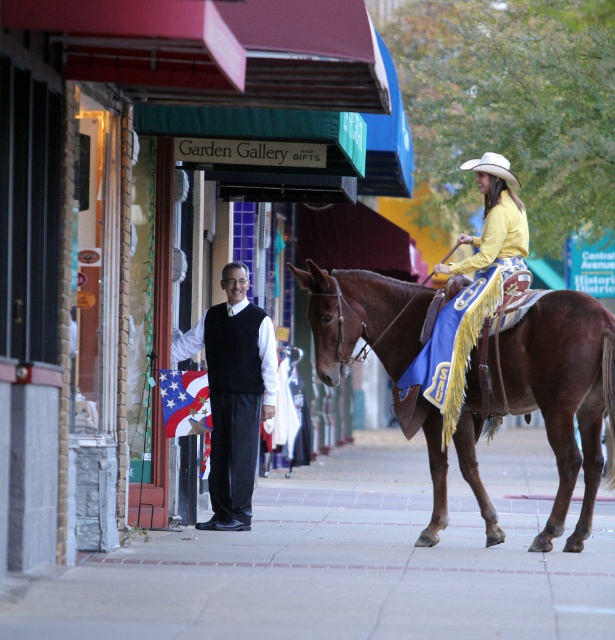
Can you confirm if smooth concrete pavement at center is positioned below black matte vest at center?

Yes.

Between smooth concrete pavement at center and black matte vest at center, which one has less height?

With less height is smooth concrete pavement at center.

Is point (538, 493) positioned in front of point (229, 330)?

No.

Where is `smooth concrete pavement at center`? The image size is (615, 640). smooth concrete pavement at center is located at coordinates (347, 560).

Can you confirm if smooth concrete pavement at center is shorter than brown leather horse at center?

Indeed, smooth concrete pavement at center has a lesser height compared to brown leather horse at center.

The height and width of the screenshot is (640, 615). What do you see at coordinates (347, 560) in the screenshot?
I see `smooth concrete pavement at center` at bounding box center [347, 560].

Image resolution: width=615 pixels, height=640 pixels. What are the coordinates of `smooth concrete pavement at center` in the screenshot? It's located at (347, 560).

Does brown leather horse at center come in front of black matte vest at center?

Yes, brown leather horse at center is in front of black matte vest at center.

Is brown leather horse at center to the right of black matte vest at center from the viewer's perspective?

Indeed, brown leather horse at center is positioned on the right side of black matte vest at center.

Locate an element on the screen. Image resolution: width=615 pixels, height=640 pixels. brown leather horse at center is located at coordinates (563, 394).